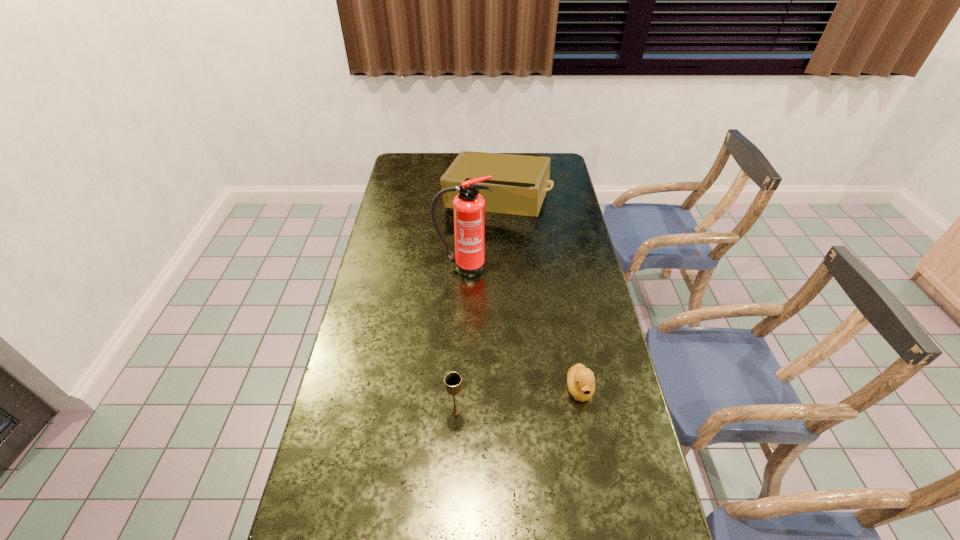
Locate an element on the screen. box situated at the right edge is located at coordinates pyautogui.click(x=519, y=183).

The width and height of the screenshot is (960, 540). Find the location of `duckling situated at the right edge`. duckling situated at the right edge is located at coordinates (581, 382).

I want to click on object that is at the far right corner, so click(519, 183).

Identify the location of free space at the left edge of the desktop. This screenshot has height=540, width=960. pos(362,539).

I want to click on vacant area at the right edge of the desktop, so [593, 415].

In the image, there is a desktop. Identify the location of free region at the far left corner. (409, 174).

Where is `vacant point located between the chalice and the farthest object`? This screenshot has width=960, height=540. vacant point located between the chalice and the farthest object is located at coordinates (476, 307).

You are a GUI agent. You are given a task and a screenshot of the screen. Output one action in this format:
    pyautogui.click(x=<x>, y=<y>)
    Task: Click on the vacant space that is in between the fourth tallest object and the box
    The height and width of the screenshot is (540, 960).
    Given the screenshot: What is the action you would take?
    pyautogui.click(x=539, y=295)

The image size is (960, 540). Find the location of `free space between the fire extinguisher and the chalice`. free space between the fire extinguisher and the chalice is located at coordinates (459, 340).

At what (x,y) coordinates should I click in order to perform the action: click on vacant area between the second farthest object and the duckling. Please return your answer as a coordinate pair (x, y). The height and width of the screenshot is (540, 960). Looking at the image, I should click on click(x=521, y=328).